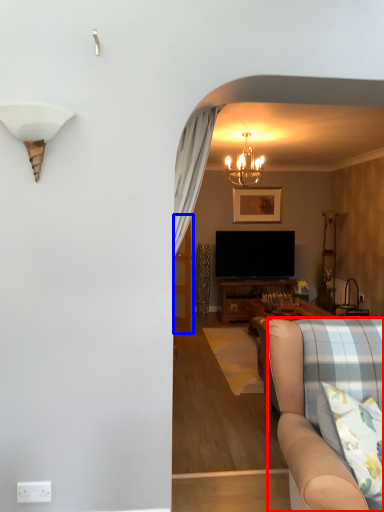
Question: Which point is closer to the camera, studio couch (highlighted by a red box) or glass door (highlighted by a blue box)?

Choices:
 (A) studio couch
 (B) glass door

Answer: (A)